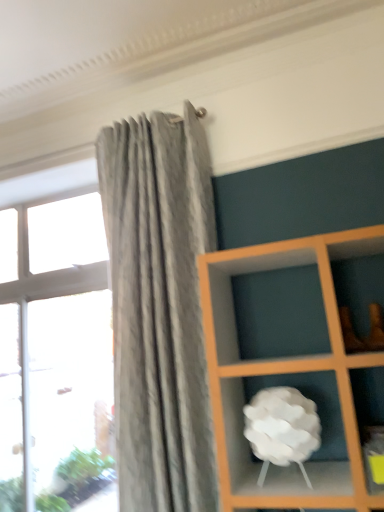
Question: Does transparent glass window at left have a greater width compared to white matte cloud at center?

Choices:
 (A) no
 (B) yes

Answer: (A)

Question: Is transparent glass window at left taller than white matte cloud at center?

Choices:
 (A) no
 (B) yes

Answer: (B)

Question: Considering the relative sizes of transparent glass window at left and white matte cloud at center in the image provided, is transparent glass window at left shorter than white matte cloud at center?

Choices:
 (A) yes
 (B) no

Answer: (B)

Question: Are transparent glass window at left and white matte cloud at center making contact?

Choices:
 (A) yes
 (B) no

Answer: (B)

Question: Does transparent glass window at left have a smaller size compared to white matte cloud at center?

Choices:
 (A) no
 (B) yes

Answer: (A)

Question: Is transparent glass window at left to the left of white matte cloud at center from the viewer's perspective?

Choices:
 (A) yes
 (B) no

Answer: (A)

Question: Is white matte cloud at center positioned with its back to transparent glass window at left?

Choices:
 (A) no
 (B) yes

Answer: (A)

Question: Is white matte cloud at center positioned in front of transparent glass window at left?

Choices:
 (A) yes
 (B) no

Answer: (A)

Question: Is white matte cloud at center thinner than transparent glass window at left?

Choices:
 (A) yes
 (B) no

Answer: (B)

Question: Can you confirm if white matte cloud at center is shorter than transparent glass window at left?

Choices:
 (A) no
 (B) yes

Answer: (B)

Question: Does white matte cloud at center appear on the left side of transparent glass window at left?

Choices:
 (A) yes
 (B) no

Answer: (B)

Question: From the image's perspective, is white matte cloud at center located beneath transparent glass window at left?

Choices:
 (A) no
 (B) yes

Answer: (A)

Question: From their relative heights in the image, would you say white matte cloud at center is taller or shorter than transparent glass window at left?

Choices:
 (A) short
 (B) tall

Answer: (A)